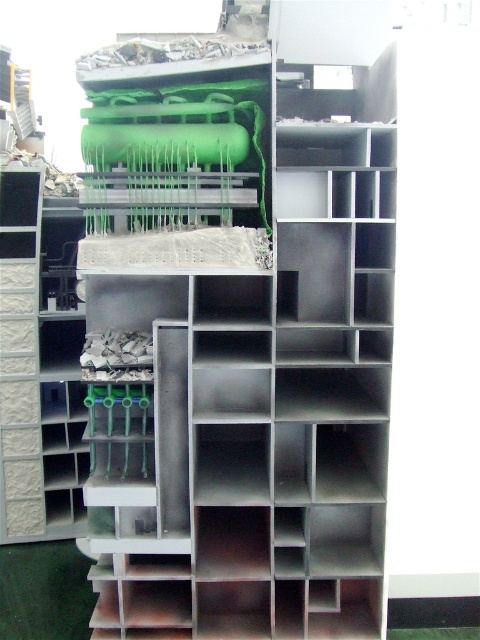
You are an engineer inspecting a complex industrial structure. You notice two points marked on the structure at coordinates point (153, 67) and point (27, 493). Which of these two points is nearer to your current viewpoint?

Point (153, 67) is closer to the camera than point (27, 493), so the point at (153, 67) is nearer to your viewpoint.

You are an interior designer planning to place a new sofa in the room. You need to ensure it doesn not block the view of the white textured brick at left from the entrance. Given that the metallic gray bookshelf at center is currently blocking the view, where should you position the sofa?

The metallic gray bookshelf at center is to the right of the white textured brick at left. To ensure the sofa does not block the view of the white textured brick at left, place the sofa to the right side of the metallic gray bookshelf at center so that the brick remains visible from the entrance.